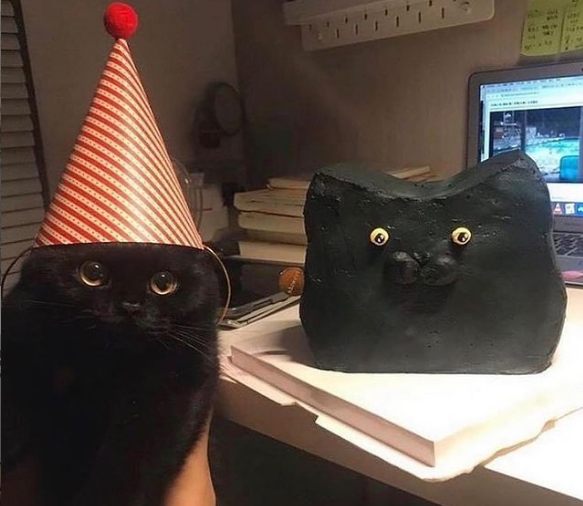
What are the coordinates of `laptop screen` in the screenshot? It's located at [x=551, y=102].